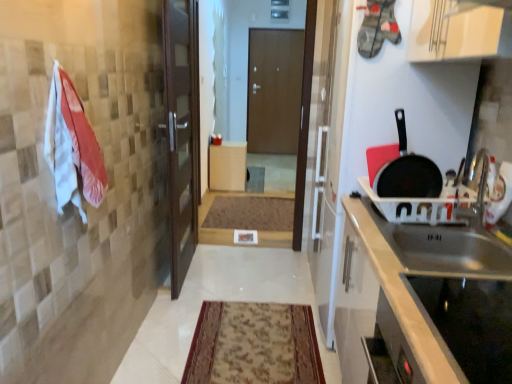
Identify the location of vacant space behind carpeted rug at center, the 1th mat from the front. (241, 281).